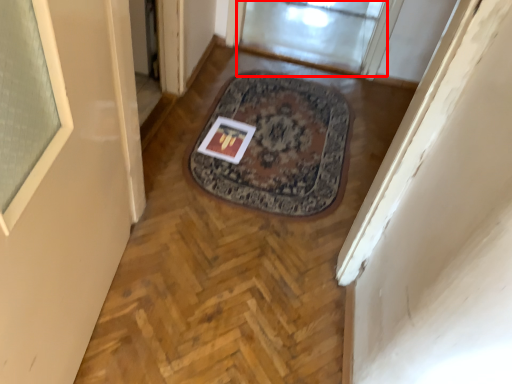
Question: From the image's perspective, where is window screen (annotated by the red box) located relative to postcard?

Choices:
 (A) above
 (B) below

Answer: (A)